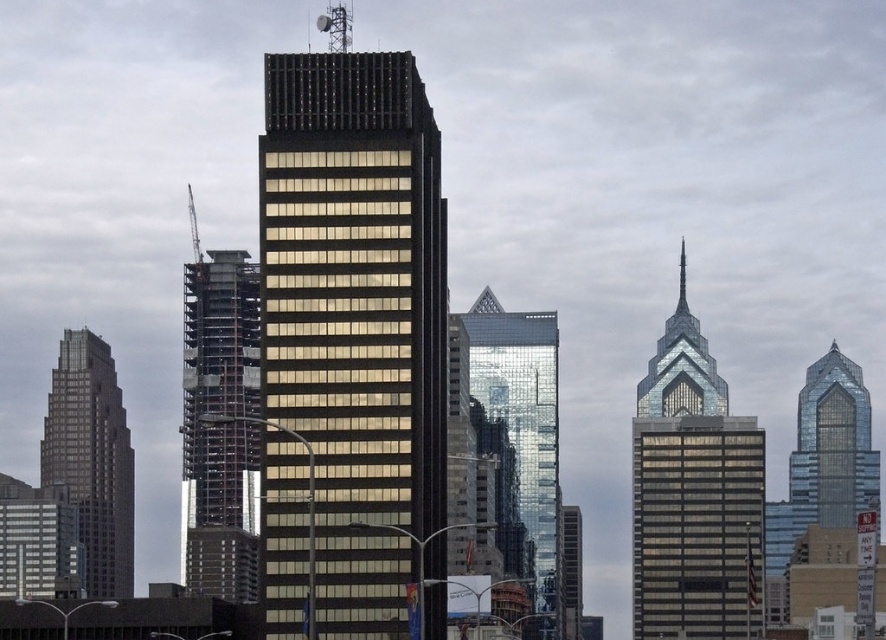
Question: Can you confirm if black glass building at center is bigger than glassy reflective skyscraper at center?

Choices:
 (A) no
 (B) yes

Answer: (B)

Question: Among these objects, which one is farthest from the camera?

Choices:
 (A) glassy reflective skyscraper at center
 (B) glassy gray skyscraper at left
 (C) black glass building at center

Answer: (B)

Question: Is the position of glassy reflective skyscraper at center less distant than that of glassy gray skyscraper at left?

Choices:
 (A) no
 (B) yes

Answer: (B)

Question: Which point is farther to the camera?

Choices:
 (A) reflective glass skyscraper at center
 (B) metallic silver construction at left
 (C) black glass building at center

Answer: (B)

Question: Based on their relative distances, which object is nearer to the glassy reflective skyscraper at center?

Choices:
 (A) reflective glass skyscraper at center
 (B) black glass building at center

Answer: (A)

Question: Can you confirm if black glass building at center is bigger than reflective glass skyscraper at center?

Choices:
 (A) no
 (B) yes

Answer: (B)